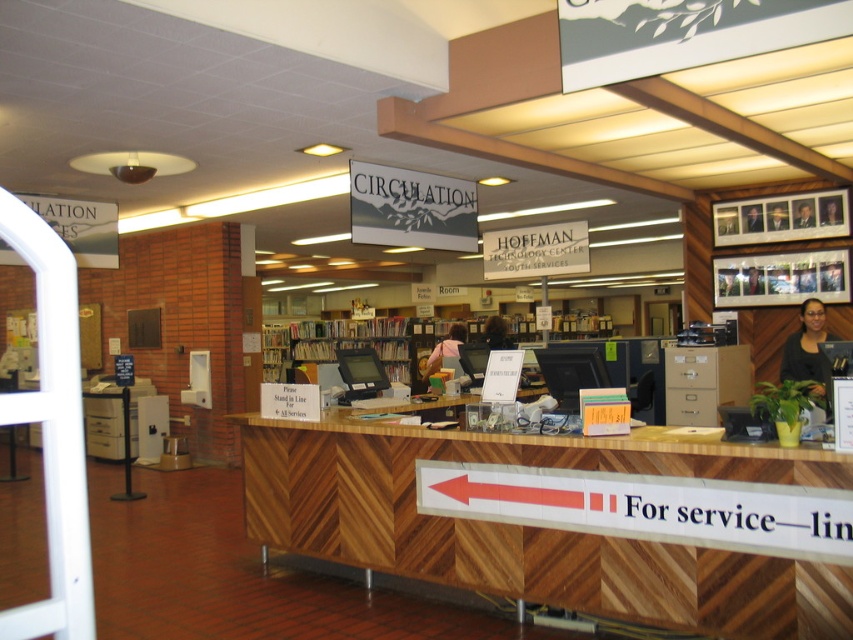
Is wooden chevron-patterned desk at center to the left of matte black hair at center from the viewer's perspective?

Yes, wooden chevron-patterned desk at center is to the left of matte black hair at center.

Which is above, wooden chevron-patterned desk at center or matte black hair at center?

matte black hair at center is above.

Is point (607, 577) closer to camera compared to point (508, 342)?

Yes, it is in front of point (508, 342).

Find the location of a particular element. The image size is (853, 640). wooden chevron-patterned desk at center is located at coordinates (535, 528).

Can you confirm if wooden chevron-patterned desk at center is positioned above black matte shirt at right?

Actually, wooden chevron-patterned desk at center is below black matte shirt at right.

This screenshot has height=640, width=853. In order to click on wooden chevron-patterned desk at center in this screenshot , I will do `click(535, 528)`.

This screenshot has height=640, width=853. What are the coordinates of `wooden chevron-patterned desk at center` in the screenshot? It's located at (x=535, y=528).

How distant is black matte shirt at right from matte black hair at center?

black matte shirt at right is 3.45 meters from matte black hair at center.

Is point (822, 317) farther from camera compared to point (502, 346)?

No, (822, 317) is closer to viewer.

At what (x,y) coordinates should I click in order to perform the action: click on black matte shirt at right. Please return your answer as a coordinate pair (x, y). This screenshot has height=640, width=853. Looking at the image, I should click on (808, 349).